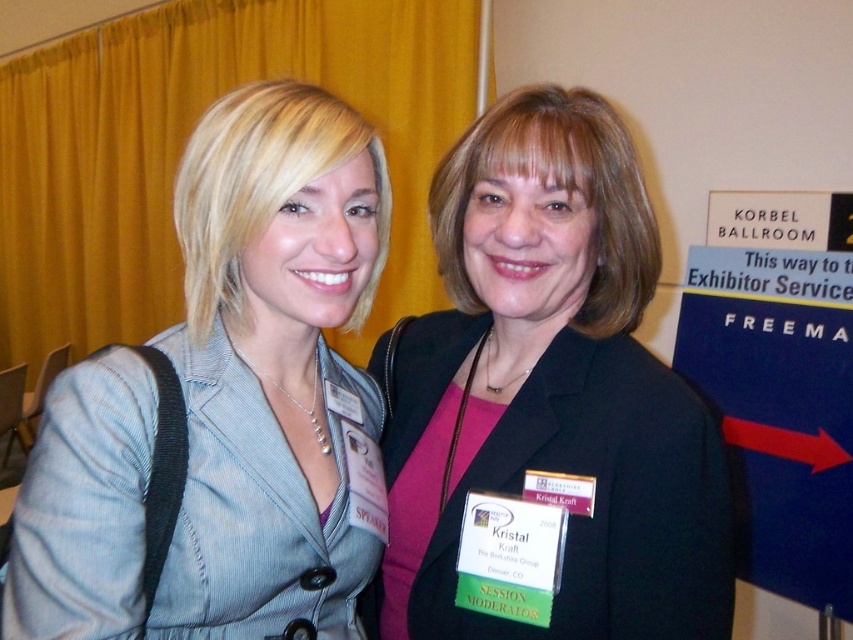
Based on the scene description, where is the denim jacket at center located in terms of its 2D coordinates?

The denim jacket at center is located at the 2D coordinates point (228, 403).